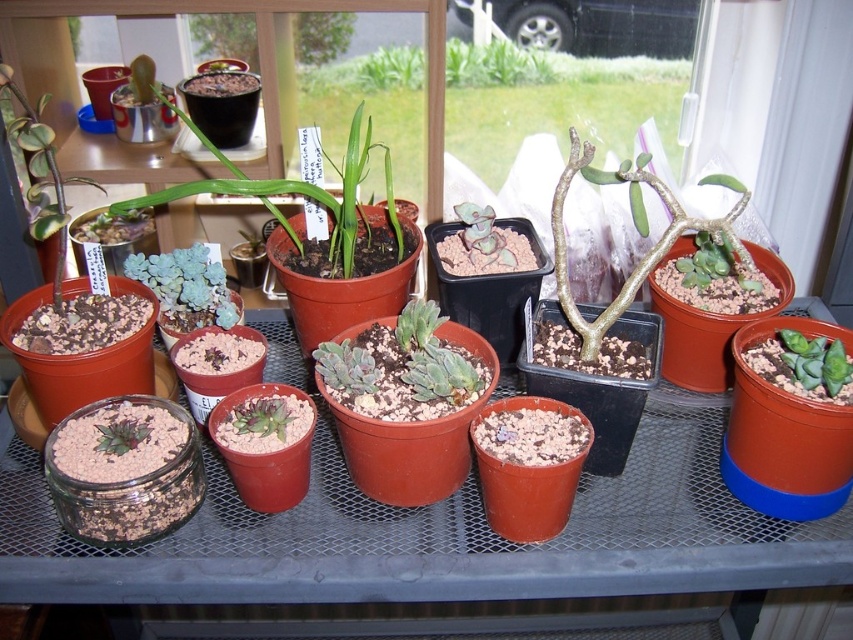
Is point (123, 268) positioned in front of point (482, 216)?

No, it is behind (482, 216).

Does green succulent at center appear on the right side of matte green succulent at center?

In fact, green succulent at center is to the left of matte green succulent at center.

The height and width of the screenshot is (640, 853). I want to click on green succulent at center, so click(x=186, y=285).

Which is above, green matte succulent at center or matte black pot at upper center?

matte black pot at upper center is higher up.

Which is in front, point (299, 186) or point (254, 35)?

Positioned in front is point (299, 186).

This screenshot has height=640, width=853. What are the coordinates of `green matte succulent at center` in the screenshot? It's located at (299, 193).

Is the position of green matte succulent at center more distant than that of green succulent at center?

That is False.

Does green matte succulent at center have a greater width compared to green succulent at center?

Yes, green matte succulent at center is wider than green succulent at center.

This screenshot has height=640, width=853. Describe the element at coordinates (299, 193) in the screenshot. I see `green matte succulent at center` at that location.

Locate an element on the screen. This screenshot has height=640, width=853. green matte succulent at center is located at coordinates [299, 193].